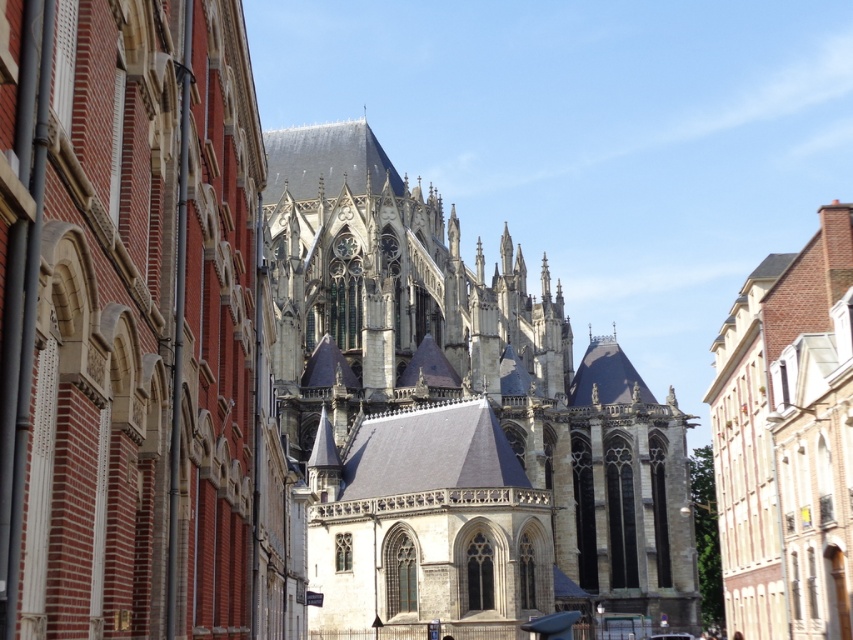
You are standing in front of the cathedral and want to take a photo that includes both point [251,214] and point [378,476]. Which point should you focus on first to ensure both are in sharp focus?

You should focus on point [251,214] first because it is closer to the camera than point [378,476], ensuring both will be in focus when using the hyperfocal distance technique.

You are an architect visiting the cathedral and notice two structures in the image. Based on their sizes, which one would require less material to construct between the dark gray stone church at center and the brick textured building at right?

The dark gray stone church at center requires less material to construct since it has a smaller size compared to the brick textured building at right.

You are standing in front of the cathedral and want to take a photo that includes both the dark gray stone church at center and the brick textured building at right. Based on their positions, which one should you position closer to the bottom of the frame to include both in your shot?

The dark gray stone church at center is located above the brick textured building at right, so to include both in the photo, you should position the brick textured building at right closer to the bottom of the frame.